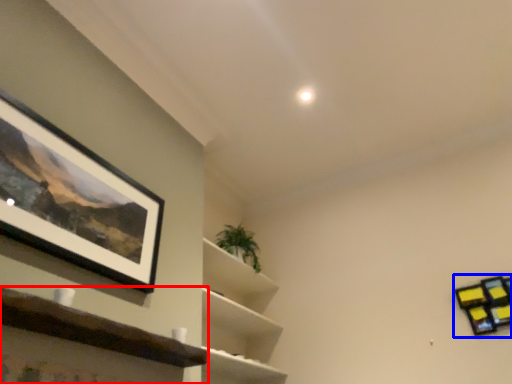
Question: Which point is closer to the camera, shelf (highlighted by a red box) or shelf (highlighted by a blue box)?

Choices:
 (A) shelf
 (B) shelf

Answer: (A)